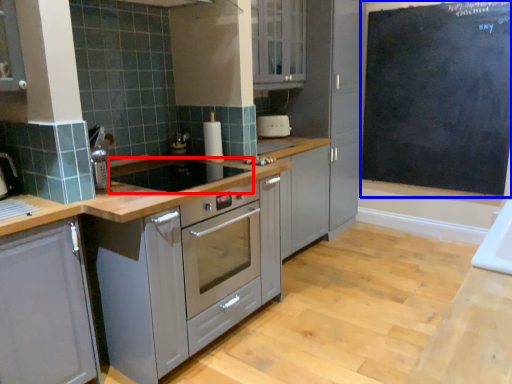
Question: Which object is further to the camera taking this photo, gas stove (highlighted by a red box) or bulletin board (highlighted by a blue box)?

Choices:
 (A) gas stove
 (B) bulletin board

Answer: (B)